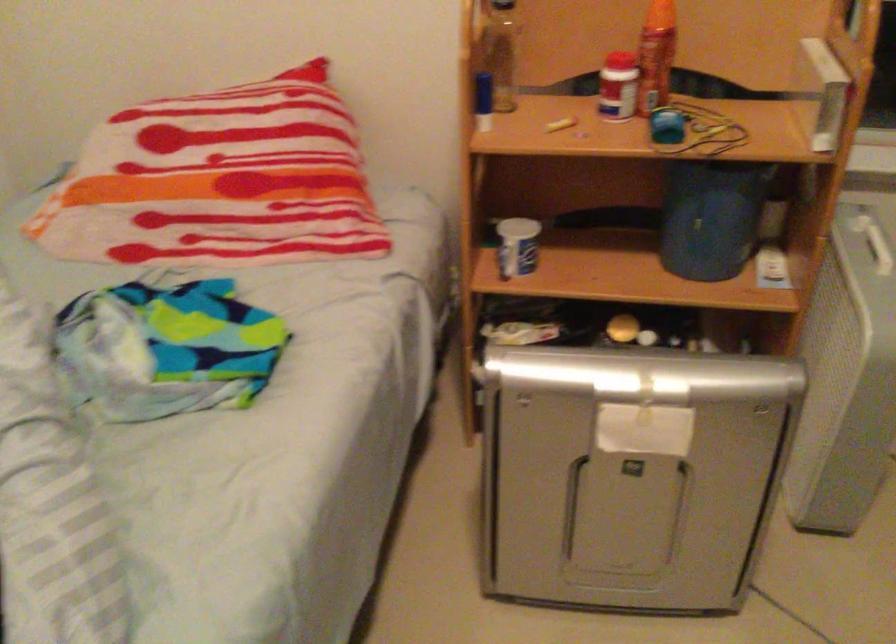
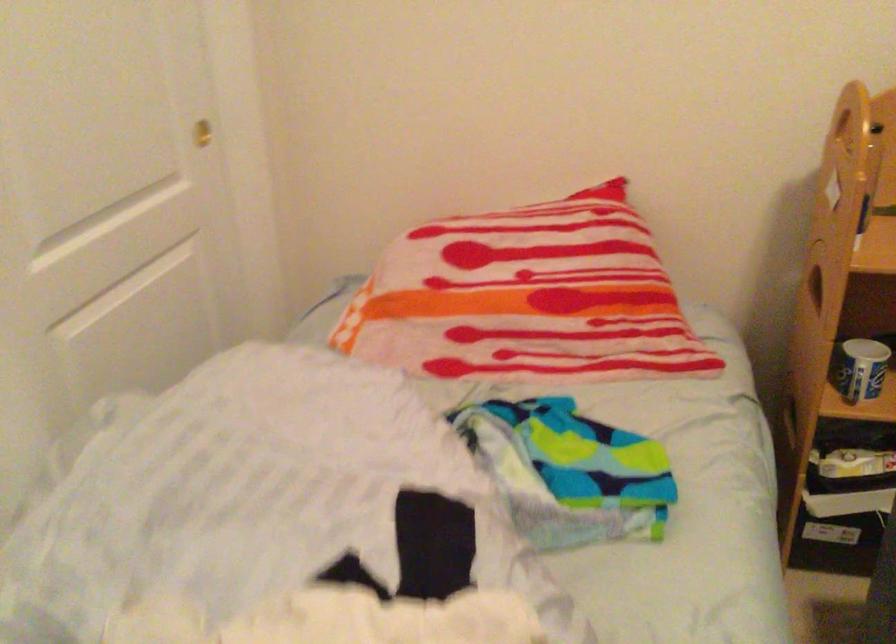
Question: How did the camera likely rotate?

Choices:
 (A) Left
 (B) Right
 (C) Up
 (D) Down

Answer: (C)